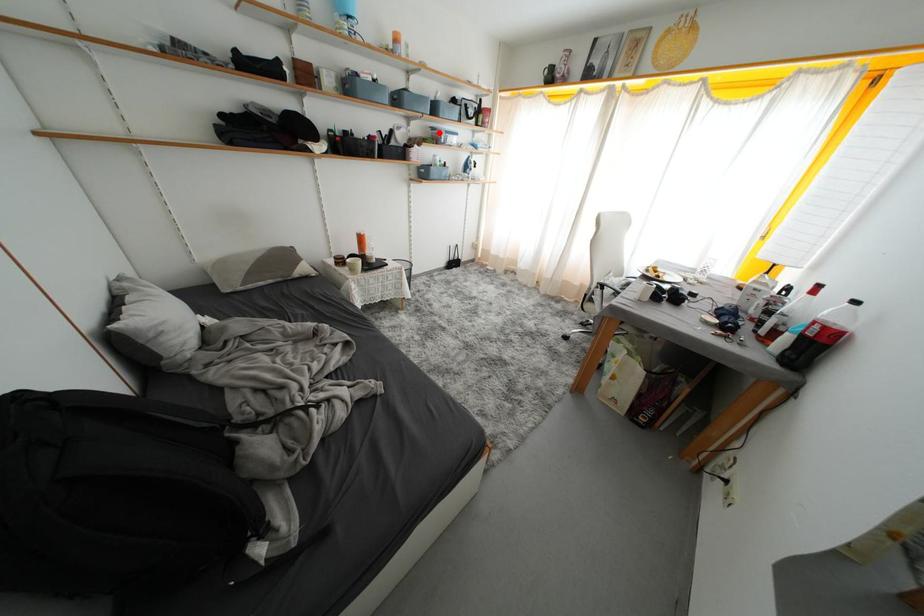
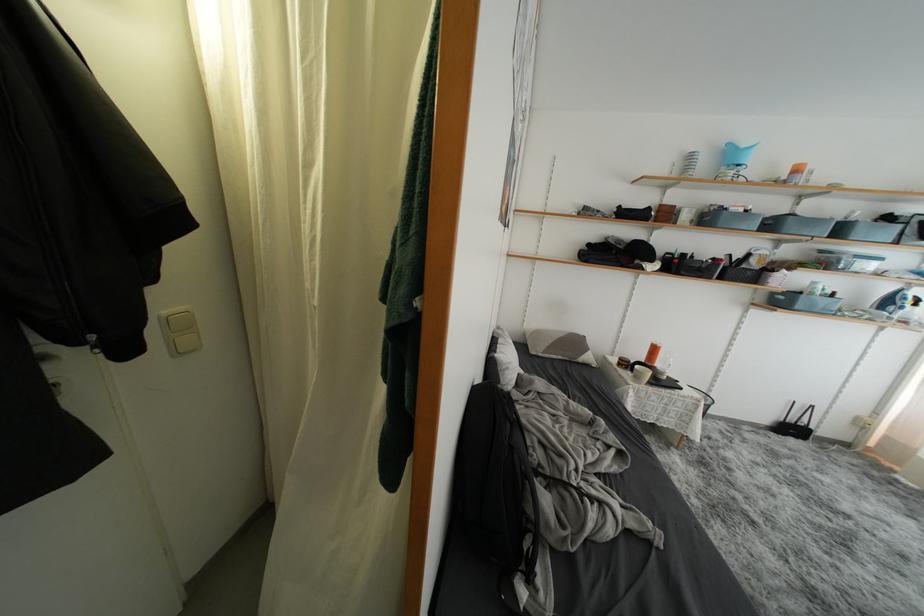
Question: I am providing you with two images of the same scene from different viewpoints. In image1, a red point is highlighted. Considering the same 3D point in image2, which of the following is correct?

Choices:
 (A) It is closer
 (B) It is farther

Answer: (B)